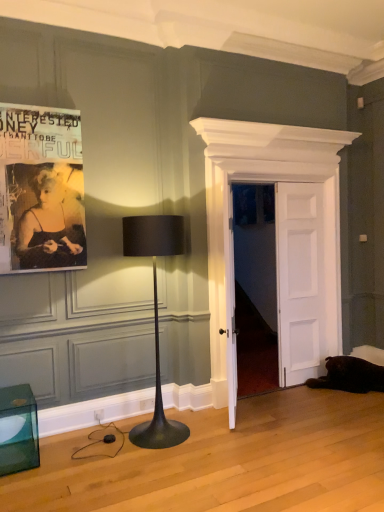
The image size is (384, 512). I want to click on vacant area located to the right-hand side of transparent glass cube at lower left, so click(x=64, y=465).